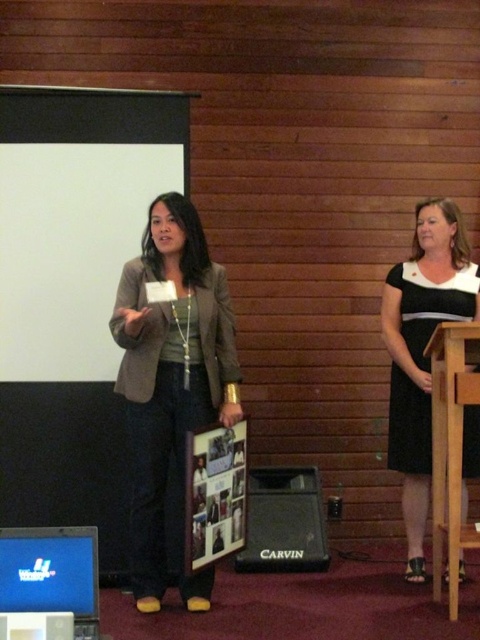
Question: Which of the following is the farthest from the observer?

Choices:
 (A) wooden podium at right
 (B) matte brown blazer at center

Answer: (A)

Question: Can you confirm if black/white dress at right is wider than black plastic speaker at lower center?

Choices:
 (A) no
 (B) yes

Answer: (A)

Question: Which of these objects is positioned farthest from the matte brown blazer at center?

Choices:
 (A) wooden podium at right
 (B) black/white dress at right

Answer: (A)

Question: Is black/white dress at right wider than wooden podium at right?

Choices:
 (A) no
 (B) yes

Answer: (B)

Question: Is white matte projection screen at upper left thinner than matte brown blazer at center?

Choices:
 (A) no
 (B) yes

Answer: (A)

Question: Among these objects, which one is farthest from the camera?

Choices:
 (A) black/white dress at right
 (B) black plastic speaker at lower center
 (C) wooden podium at right

Answer: (B)